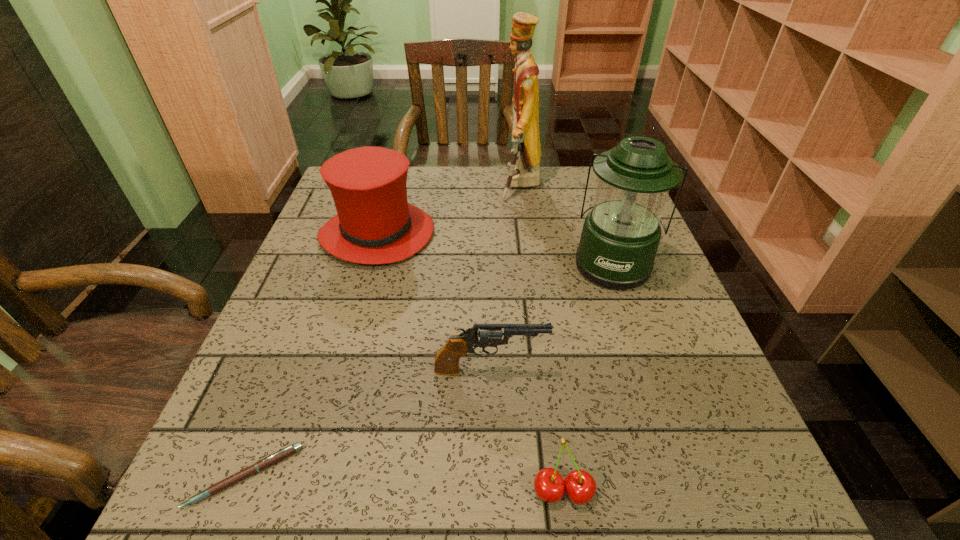
Locate an element on the screen. Image resolution: width=960 pixels, height=540 pixels. vacant area that lies between the hat and the cherry is located at coordinates (470, 363).

The image size is (960, 540). I want to click on free space between the hat and the shortest object, so click(x=312, y=355).

This screenshot has width=960, height=540. Find the location of `unoccupied area between the cherry and the pen`. unoccupied area between the cherry and the pen is located at coordinates (404, 484).

This screenshot has height=540, width=960. Find the location of `vacant area that lies between the shortest object and the fourth shortest object`. vacant area that lies between the shortest object and the fourth shortest object is located at coordinates (312, 355).

The width and height of the screenshot is (960, 540). I want to click on free space between the rightmost object and the nutcracker, so click(x=566, y=225).

Image resolution: width=960 pixels, height=540 pixels. What are the coordinates of `blank region between the gun and the tallest object` in the screenshot? It's located at (505, 278).

The width and height of the screenshot is (960, 540). I want to click on free space between the shortest object and the rightmost object, so click(x=429, y=370).

This screenshot has width=960, height=540. What are the coordinates of `free area in between the tallest object and the shortest object` in the screenshot? It's located at pyautogui.click(x=383, y=330).

What are the coordinates of `object identified as the fourth closest to the third tallest object` in the screenshot? It's located at (268, 461).

Identify which object is the second nearest to the nutcracker. Please provide its 2D coordinates. Your answer should be formatted as a tuple, i.e. [(x, y)], where the tuple contains the x and y coordinates of a point satisfying the conditions above.

[(375, 224)]